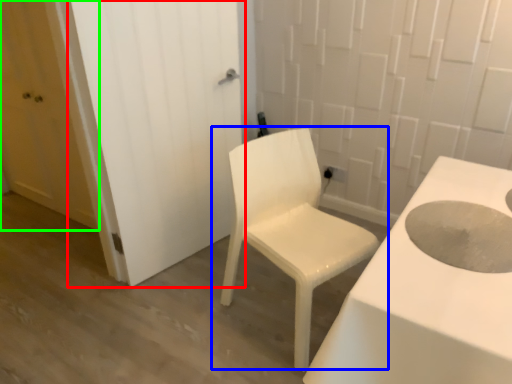
Question: Estimate the real-world distances between objects in this image. Which object is closer to door (highlighted by a red box), chair (highlighted by a blue box) or door (highlighted by a green box)?

Choices:
 (A) chair
 (B) door

Answer: (A)